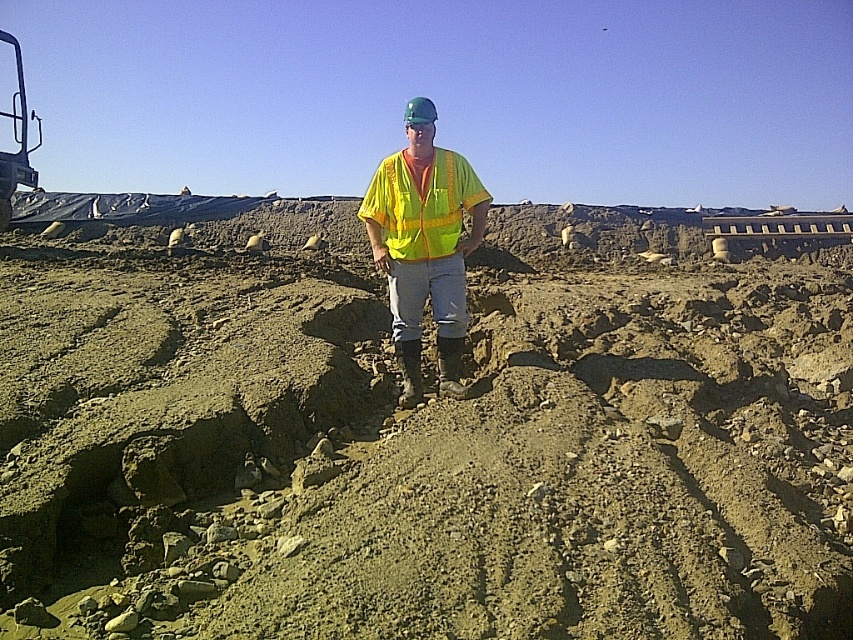
Question: Is dull brown dirt at center positioned at the back of yellow reflective vest at center?

Choices:
 (A) yes
 (B) no

Answer: (B)

Question: Which point is farther from the camera taking this photo?

Choices:
 (A) (125, 490)
 (B) (450, 289)

Answer: (B)

Question: Is dull brown dirt at center further to camera compared to yellow reflective vest at center?

Choices:
 (A) no
 (B) yes

Answer: (A)

Question: Can you confirm if dull brown dirt at center is smaller than yellow reflective vest at center?

Choices:
 (A) yes
 (B) no

Answer: (B)

Question: Among these objects, which one is nearest to the camera?

Choices:
 (A) yellow reflective vest at center
 (B) dull brown dirt at center

Answer: (B)

Question: Which point appears closest to the camera in this image?

Choices:
 (A) (461, 301)
 (B) (495, 483)

Answer: (B)